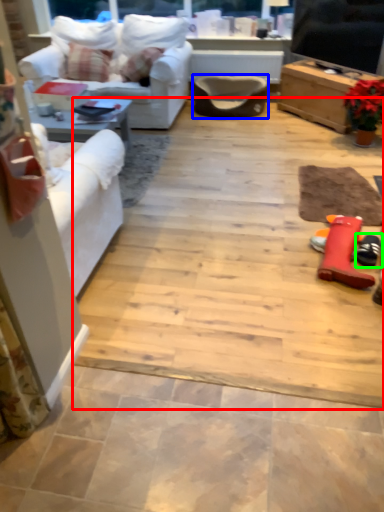
Question: Based on their relative distances, which object is farther from ceramic tile (highlighted by a red box)? Choose from armchair (highlighted by a blue box) and footwear (highlighted by a green box).

Choices:
 (A) armchair
 (B) footwear

Answer: (A)